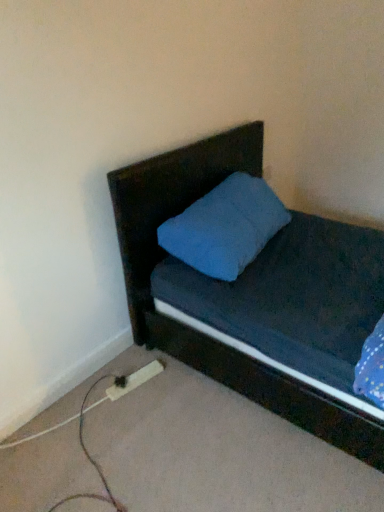
Question: Is wooden extension cord at lower left bigger or smaller than matte dark wood headboard at upper center?

Choices:
 (A) small
 (B) big

Answer: (A)

Question: In terms of height, does wooden extension cord at lower left look taller or shorter compared to matte dark wood headboard at upper center?

Choices:
 (A) tall
 (B) short

Answer: (B)

Question: Is wooden extension cord at lower left in front of or behind matte dark wood headboard at upper center in the image?

Choices:
 (A) front
 (B) behind

Answer: (B)

Question: In terms of width, does matte dark wood headboard at upper center look wider or thinner when compared to wooden extension cord at lower left?

Choices:
 (A) thin
 (B) wide

Answer: (B)

Question: From a real-world perspective, is matte dark wood headboard at upper center physically located above or below wooden extension cord at lower left?

Choices:
 (A) above
 (B) below

Answer: (A)

Question: Is point (145, 303) positioned closer to the camera than point (142, 378)?

Choices:
 (A) farther
 (B) closer

Answer: (A)

Question: From the image's perspective, is matte dark wood headboard at upper center located above or below wooden extension cord at lower left?

Choices:
 (A) below
 (B) above

Answer: (B)